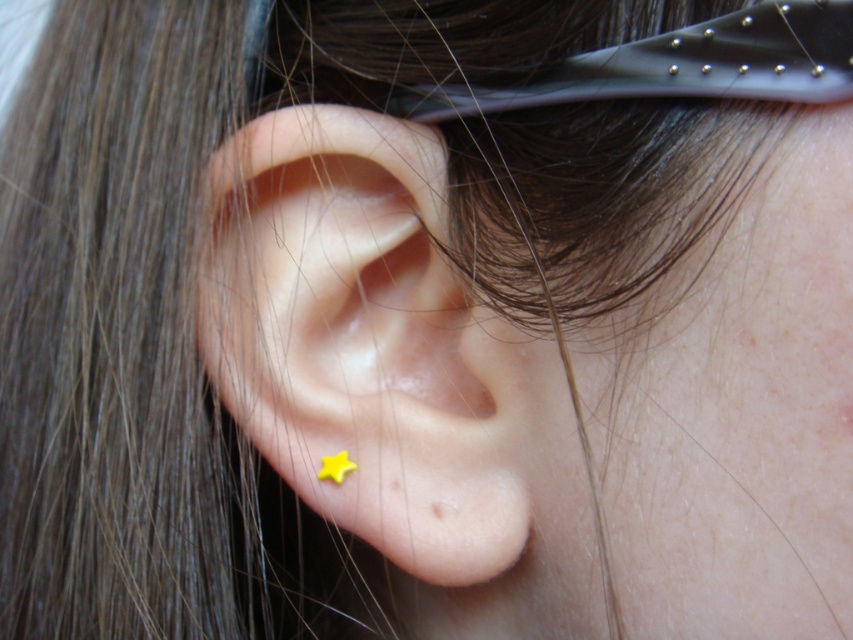
Can you confirm if yellow matte star at center is wider than yellow matte star at ear?

Indeed, yellow matte star at center has a greater width compared to yellow matte star at ear.

Does point (419, 428) lie behind point (341, 476)?

That is False.

Between point (291, 376) and point (331, 476), which one is positioned behind?

The point (331, 476) is behind.

Where is `yellow matte star at center`? This screenshot has width=853, height=640. yellow matte star at center is located at coordinates (364, 339).